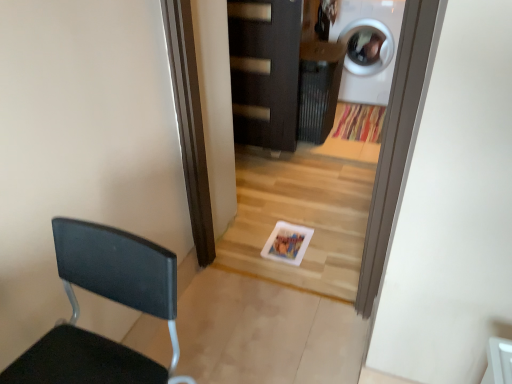
Find the location of a particular element. dark wood door at center is located at coordinates (265, 71).

Identify the location of black matte chair at left. (109, 299).

Find the location of a particular element. white glossy washing machine at upper right is located at coordinates (368, 48).

Does white glossy washing machine at upper right have a greater width compared to black matte chair at left?

Yes.

Can you tell me how much white glossy washing machine at upper right and black matte chair at left differ in facing direction?

They differ by 4.23 degrees in their facing directions.

Which is correct: white glossy washing machine at upper right is inside black matte chair at left, or outside of it?

white glossy washing machine at upper right lies outside black matte chair at left.

From a real-world perspective, which is physically below, white glossy washing machine at upper right or black matte chair at left?

In real-world perspective, white glossy washing machine at upper right is lower.

Are black matte chair at left and dark wood door at center located far from each other?

black matte chair at left is positioned a significant distance from dark wood door at center.

Considering the positions of objects black matte chair at left and dark wood door at center in the image provided, who is more to the left, black matte chair at left or dark wood door at center?

black matte chair at left is more to the left.

Can you confirm if black matte chair at left is taller than dark wood door at center?

No.

From a real-world perspective, who is located higher, black matte chair at left or dark wood door at center?

black matte chair at left, from a real-world perspective.

Is dark wood door at center inside the boundaries of white glossy washing machine at upper right, or outside?

dark wood door at center cannot be found inside white glossy washing machine at upper right.

Between dark wood door at center and white glossy washing machine at upper right, which one has smaller width?

Thinner between the two is dark wood door at center.

Which is closer, (276, 6) or (369, 87)?

The point (276, 6) is closer.

Consider the image. Can you tell me how much dark wood door at center and black matte chair at left differ in facing direction?

The angle between the facing direction of dark wood door at center and the facing direction of black matte chair at left is 4.22 degrees.

Does dark wood door at center have a greater height compared to black matte chair at left?

Indeed, dark wood door at center has a greater height compared to black matte chair at left.

Would you say dark wood door at center is a long distance from black matte chair at left?

Yes, dark wood door at center and black matte chair at left are quite far apart.

From the image's perspective, relative to black matte chair at left, is dark wood door at center above or below?

dark wood door at center is situated higher than black matte chair at left in the image.

Is white glossy washing machine at upper right located outside dark wood door at center?

white glossy washing machine at upper right is positioned outside dark wood door at center.

Who is taller, white glossy washing machine at upper right or dark wood door at center?

dark wood door at center.

Is white glossy washing machine at upper right to the left or to the right of dark wood door at center in the image?

Based on their positions, white glossy washing machine at upper right is located to the right of dark wood door at center.

How different are the orientations of white glossy washing machine at upper right and dark wood door at center in degrees?

There is a 0.000628-degree angle between the facing directions of white glossy washing machine at upper right and dark wood door at center.

Could you tell me if black matte chair at left is facing white glossy washing machine at upper right?

No, black matte chair at left is not facing towards white glossy washing machine at upper right.

From a real-world perspective, is black matte chair at left above or below white glossy washing machine at upper right?

black matte chair at left is above white glossy washing machine at upper right.

Is the surface of black matte chair at left in direct contact with white glossy washing machine at upper right?

There is a gap between black matte chair at left and white glossy washing machine at upper right.

You are a GUI agent. You are given a task and a screenshot of the screen. Output one action in this format:
    pyautogui.click(x=<x>, y=<y>)
    Task: Click on the washing machine that appears behind the black matte chair at left
    This screenshot has width=512, height=384.
    Given the screenshot: What is the action you would take?
    pyautogui.click(x=368, y=48)

You are a GUI agent. You are given a task and a screenshot of the screen. Output one action in this format:
    pyautogui.click(x=<x>, y=<y>)
    Task: Click on the chair above the white glossy washing machine at upper right (from a real-world perspective)
    
    Given the screenshot: What is the action you would take?
    pyautogui.click(x=109, y=299)

What are the coordinates of `door above the black matte chair at left (from the image's perspective)` in the screenshot? It's located at (265, 71).

Considering their positions, is black matte chair at left positioned further to white glossy washing machine at upper right than dark wood door at center?

black matte chair at left is further to white glossy washing machine at upper right.

Which object lies further to the anchor point black matte chair at left, white glossy washing machine at upper right or dark wood door at center?

white glossy washing machine at upper right is further to black matte chair at left.

Estimate the real-world distances between objects in this image. Which object is closer to dark wood door at center, white glossy washing machine at upper right or black matte chair at left?

white glossy washing machine at upper right is closer to dark wood door at center.

When comparing their distances from dark wood door at center, does black matte chair at left or white glossy washing machine at upper right seem further?

black matte chair at left.

Looking at the image, which one is located closer to white glossy washing machine at upper right, dark wood door at center or black matte chair at left?

dark wood door at center lies closer to white glossy washing machine at upper right than the other object.

Estimate the real-world distances between objects in this image. Which object is further from black matte chair at left, dark wood door at center or white glossy washing machine at upper right?

white glossy washing machine at upper right lies further to black matte chair at left than the other object.

Where is `door between black matte chair at left and white glossy washing machine at upper right along the z-axis`? The image size is (512, 384). door between black matte chair at left and white glossy washing machine at upper right along the z-axis is located at coordinates click(265, 71).